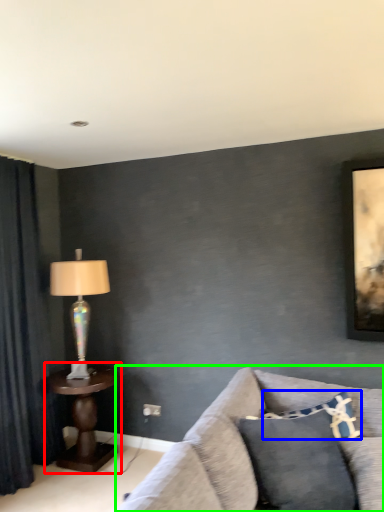
Question: Based on their relative distances, which object is nearer to table (highlighted by a red box)? Choose from pillow (highlighted by a blue box) and studio couch (highlighted by a green box).

Choices:
 (A) pillow
 (B) studio couch

Answer: (B)